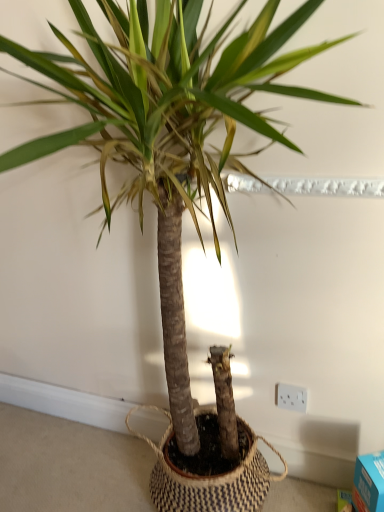
What do you see at coordinates (291, 397) in the screenshot?
I see `white plastic electric outlet at lower right` at bounding box center [291, 397].

Find the location of a particular element. This screenshot has width=384, height=512. white plastic electric outlet at lower right is located at coordinates (291, 397).

Measure the distance between white plastic electric outlet at lower right and camera.

1.20 meters.

Describe the element at coordinates (369, 482) in the screenshot. I see `blue cardboard box at lower right` at that location.

This screenshot has height=512, width=384. What are the coordinates of `blue cardboard box at lower right` in the screenshot? It's located at (369, 482).

Locate an element on the screen. white plastic electric outlet at lower right is located at coordinates (291, 397).

Considering the positions of objects white plastic electric outlet at lower right and blue cardboard box at lower right in the image provided, who is more to the right, white plastic electric outlet at lower right or blue cardboard box at lower right?

blue cardboard box at lower right is more to the right.

Who is more distant, white plastic electric outlet at lower right or blue cardboard box at lower right?

white plastic electric outlet at lower right.

Which is behind, point (305, 397) or point (354, 482)?

The point (305, 397) is more distant.

From the image's perspective, would you say white plastic electric outlet at lower right is positioned over blue cardboard box at lower right?

Yes.

From a real-world perspective, which is physically below, white plastic electric outlet at lower right or blue cardboard box at lower right?

In real-world perspective, blue cardboard box at lower right is lower.

Between white plastic electric outlet at lower right and blue cardboard box at lower right, which one has larger width?

With larger width is blue cardboard box at lower right.

From their relative heights in the image, would you say white plastic electric outlet at lower right is taller or shorter than blue cardboard box at lower right?

Clearly, white plastic electric outlet at lower right is shorter compared to blue cardboard box at lower right.

Looking at this image, is white plastic electric outlet at lower right bigger than blue cardboard box at lower right?

No.

Is white plastic electric outlet at lower right spatially inside blue cardboard box at lower right, or outside of it?

white plastic electric outlet at lower right lies outside blue cardboard box at lower right.

Based on the photo, are white plastic electric outlet at lower right and blue cardboard box at lower right beside each other?

No, white plastic electric outlet at lower right is not with blue cardboard box at lower right.

Is blue cardboard box at lower right at the back of white plastic electric outlet at lower right?

No, white plastic electric outlet at lower right is not facing the opposite direction of blue cardboard box at lower right.

Locate an element on the screen. The width and height of the screenshot is (384, 512). box located in front of the white plastic electric outlet at lower right is located at coordinates (369, 482).

Which is more to the left, blue cardboard box at lower right or white plastic electric outlet at lower right?

white plastic electric outlet at lower right is more to the left.

Relative to white plastic electric outlet at lower right, is blue cardboard box at lower right in front or behind?

Clearly, blue cardboard box at lower right is in front of white plastic electric outlet at lower right.

Considering the points (376, 455) and (287, 394), which point is in front, point (376, 455) or point (287, 394)?

Point (376, 455)

From the image's perspective, between blue cardboard box at lower right and white plastic electric outlet at lower right, which one is located above?

white plastic electric outlet at lower right appears higher in the image.

From a real-world perspective, between blue cardboard box at lower right and white plastic electric outlet at lower right, who is vertically higher?

In real-world perspective, white plastic electric outlet at lower right is above.

In the scene shown: Considering the sizes of objects blue cardboard box at lower right and white plastic electric outlet at lower right in the image provided, who is thinner, blue cardboard box at lower right or white plastic electric outlet at lower right?

Answer: white plastic electric outlet at lower right is thinner.

Can you confirm if blue cardboard box at lower right is taller than white plastic electric outlet at lower right?

Yes, blue cardboard box at lower right is taller than white plastic electric outlet at lower right.

Is blue cardboard box at lower right bigger or smaller than white plastic electric outlet at lower right?

Clearly, blue cardboard box at lower right is larger in size than white plastic electric outlet at lower right.

From the picture: Is white plastic electric outlet at lower right surrounded by blue cardboard box at lower right?

Definitely not — white plastic electric outlet at lower right is not inside blue cardboard box at lower right.

Is the surface of blue cardboard box at lower right in direct contact with white plastic electric outlet at lower right?

blue cardboard box at lower right and white plastic electric outlet at lower right are clearly separated.

Could you tell me if blue cardboard box at lower right is facing white plastic electric outlet at lower right?

No, blue cardboard box at lower right is not turned towards white plastic electric outlet at lower right.

Where is `box beneath the white plastic electric outlet at lower right (from a real-world perspective)`? The image size is (384, 512). box beneath the white plastic electric outlet at lower right (from a real-world perspective) is located at coordinates (369, 482).

Where is `electric outlet that is above the blue cardboard box at lower right (from the image's perspective)`? Image resolution: width=384 pixels, height=512 pixels. electric outlet that is above the blue cardboard box at lower right (from the image's perspective) is located at coordinates (291, 397).

Find the location of a particular element. electric outlet located above the blue cardboard box at lower right (from a real-world perspective) is located at coordinates (291, 397).